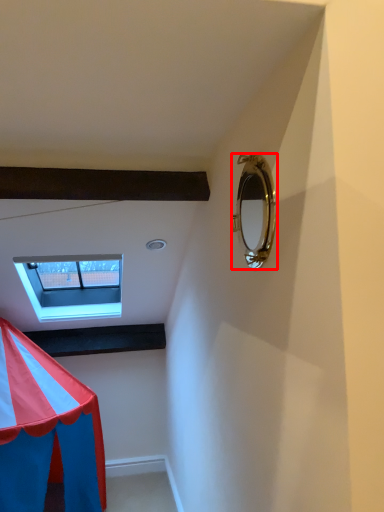
Question: Observing the image, what is the correct spatial positioning of mirror (annotated by the red box) in reference to window?

Choices:
 (A) left
 (B) right

Answer: (B)